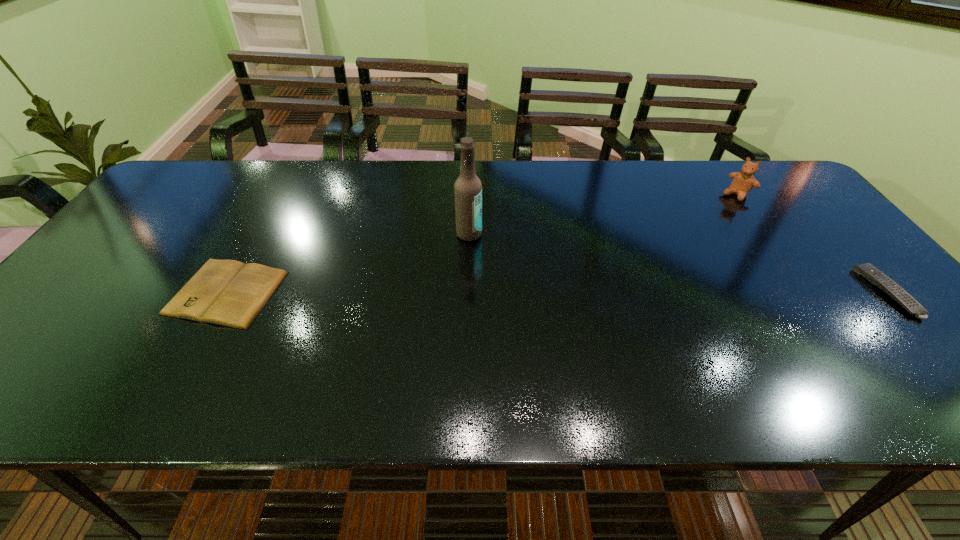
In order to click on blank space located 0.400m on the side of the second farthest object with the label in this screenshot , I will do tap(572, 344).

Locate an element on the screen. This screenshot has width=960, height=540. blank area located 0.300m on the face of the teddy bear is located at coordinates (682, 246).

This screenshot has width=960, height=540. What are the coordinates of `vacant space located 0.250m on the face of the teddy bear` in the screenshot? It's located at (690, 238).

This screenshot has width=960, height=540. Find the location of `free region located 0.060m on the face of the teddy bear`. free region located 0.060m on the face of the teddy bear is located at coordinates (721, 208).

Image resolution: width=960 pixels, height=540 pixels. I want to click on object positioned at the far edge, so pos(743,182).

You are a GUI agent. You are given a task and a screenshot of the screen. Output one action in this format:
    pyautogui.click(x=<x>, y=<y>)
    Task: Click on the object at the near edge
    
    Given the screenshot: What is the action you would take?
    pyautogui.click(x=226, y=292)

In order to click on remote control present at the right edge in this screenshot , I will do `click(868, 271)`.

This screenshot has width=960, height=540. I want to click on teddy bear that is positioned at the right edge, so click(743, 182).

Find the location of `object present at the far right corner`. object present at the far right corner is located at coordinates (743, 182).

Locate an element on the screen. free space at the far edge of the desktop is located at coordinates (521, 166).